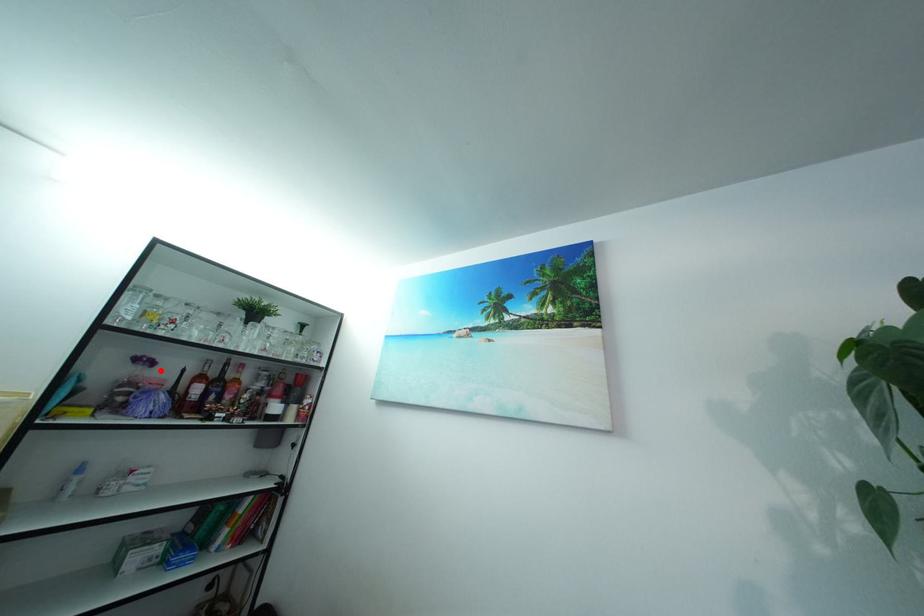
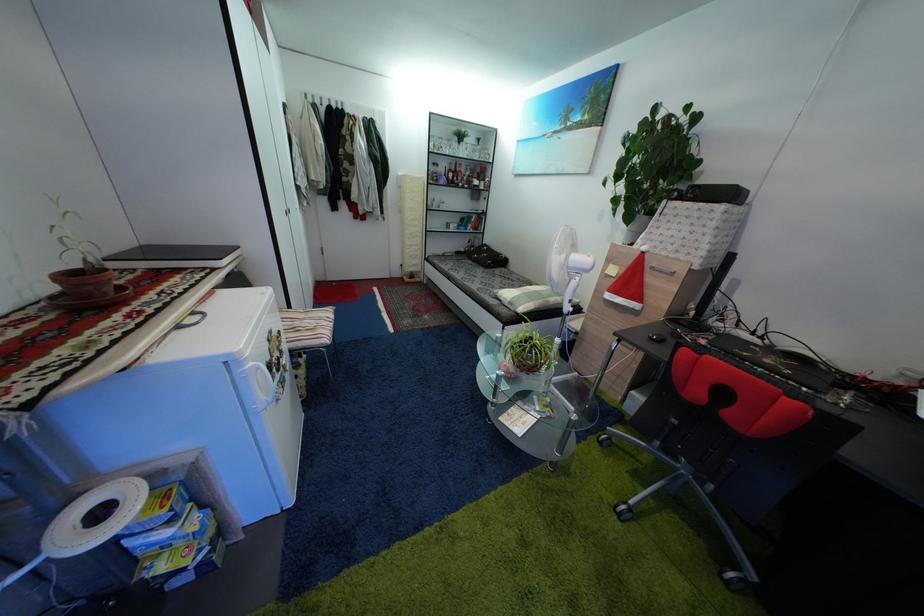
The point at the highlighted location is marked in the first image. Where is the corresponding point in the second image?

(445, 172)